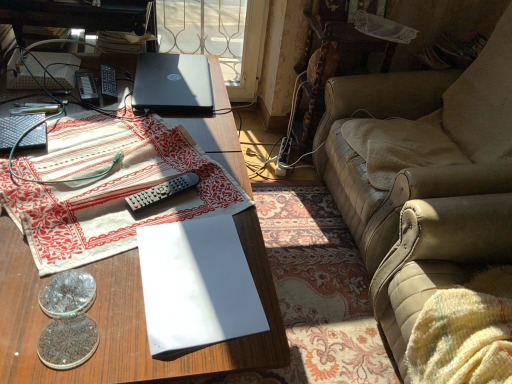
Question: Is wooden desk at center wider than white paper at center, the 2th paperback book when ordered from top to bottom?

Choices:
 (A) no
 (B) yes

Answer: (B)

Question: Considering the relative positions of wooden desk at center and white paper at center, marked as the first paperback book in a front-to-back arrangement, in the image provided, is wooden desk at center to the right of white paper at center, marked as the first paperback book in a front-to-back arrangement, from the viewer's perspective?

Choices:
 (A) no
 (B) yes

Answer: (A)

Question: Is wooden desk at center not within white paper at center, the 2th paperback book when ordered from top to bottom?

Choices:
 (A) yes
 (B) no

Answer: (A)

Question: Could white paper at center, which appears as the first paperback book when ordered from the bottom, be considered to be inside wooden desk at center?

Choices:
 (A) no
 (B) yes

Answer: (A)

Question: Considering the relative positions of wooden desk at center and white paper at center, which is counted as the second paperback book, starting from the left, in the image provided, is wooden desk at center to the left of white paper at center, which is counted as the second paperback book, starting from the left, from the viewer's perspective?

Choices:
 (A) no
 (B) yes

Answer: (B)

Question: Is wooden desk at center closer to camera compared to white paper at center, which appears as the first paperback book when ordered from the bottom?

Choices:
 (A) yes
 (B) no

Answer: (A)

Question: Does shiny metallic coin at lower left, placed as the 1th coin when sorted from back to front, appear on the left side of white paper at center, which is the first paperback book in right-to-left order?

Choices:
 (A) no
 (B) yes

Answer: (B)

Question: Is shiny metallic coin at lower left, placed as the second coin when sorted from front to back, bigger than white paper at center, which is the first paperback book in right-to-left order?

Choices:
 (A) no
 (B) yes

Answer: (A)

Question: Is shiny metallic coin at lower left, placed as the 1th coin when sorted from back to front, shorter than white paper at center, which is counted as the second paperback book, starting from the left?

Choices:
 (A) yes
 (B) no

Answer: (B)

Question: From the image's perspective, would you say shiny metallic coin at lower left, placed as the second coin when sorted from front to back, is shown under white paper at center, marked as the first paperback book in a front-to-back arrangement?

Choices:
 (A) yes
 (B) no

Answer: (A)

Question: From the image's perspective, is shiny metallic coin at lower left, placed as the 1th coin when sorted from back to front, over white paper at center, which is counted as the second paperback book, starting from the left?

Choices:
 (A) yes
 (B) no

Answer: (B)

Question: Can you see shiny metallic coin at lower left, placed as the 1th coin when sorted from back to front, touching white paper at center, which appears as the first paperback book when ordered from the bottom?

Choices:
 (A) yes
 (B) no

Answer: (B)

Question: Is the position of lace fabric at upper right more distant than that of white paper at center, which is the first paperback book in right-to-left order?

Choices:
 (A) yes
 (B) no

Answer: (A)